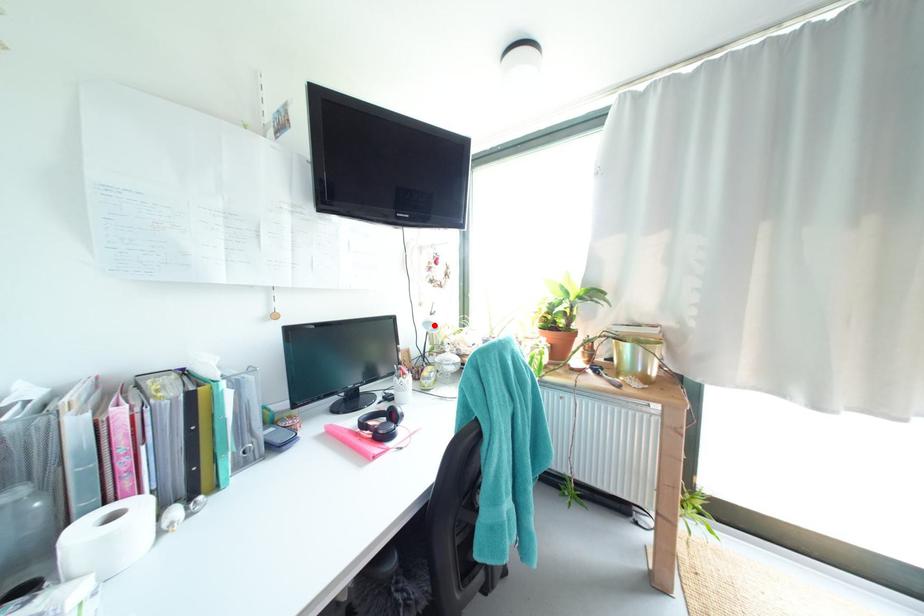
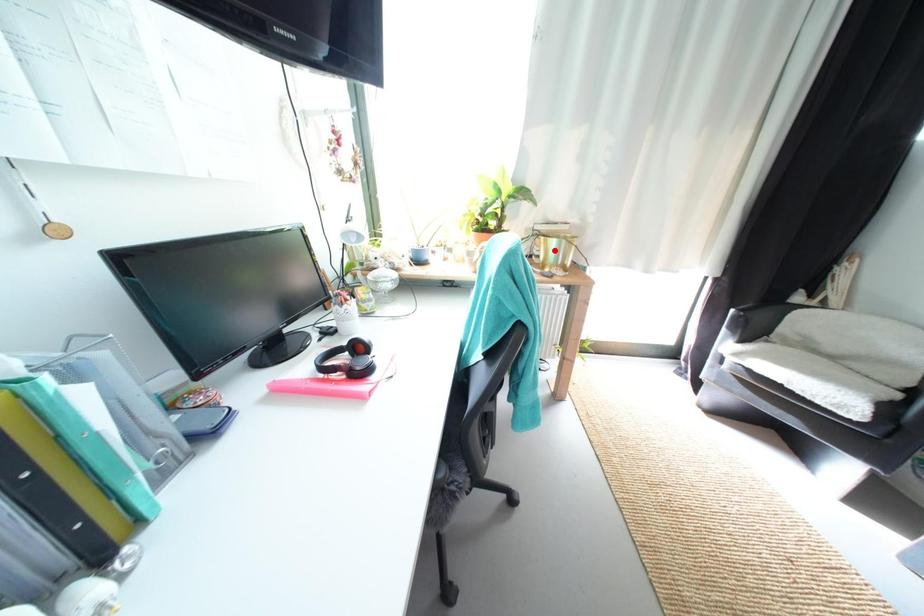
I am providing you with two images of the same scene from different viewpoints. A red point is marked on the first image and another point is marked on the second image. Does the point marked in image1 correspond to the same location as the one in image2?

No